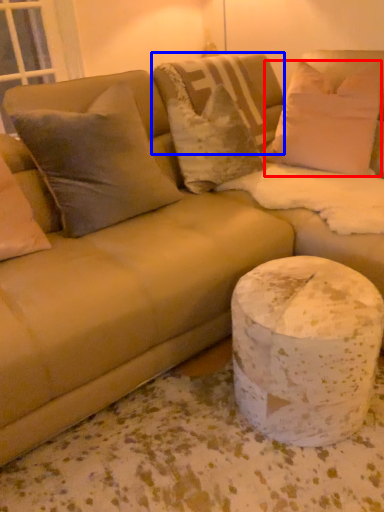
Question: Which of the following is the farthest to the observer, pillow (highlighted by a red box) or pillow (highlighted by a blue box)?

Choices:
 (A) pillow
 (B) pillow

Answer: (B)